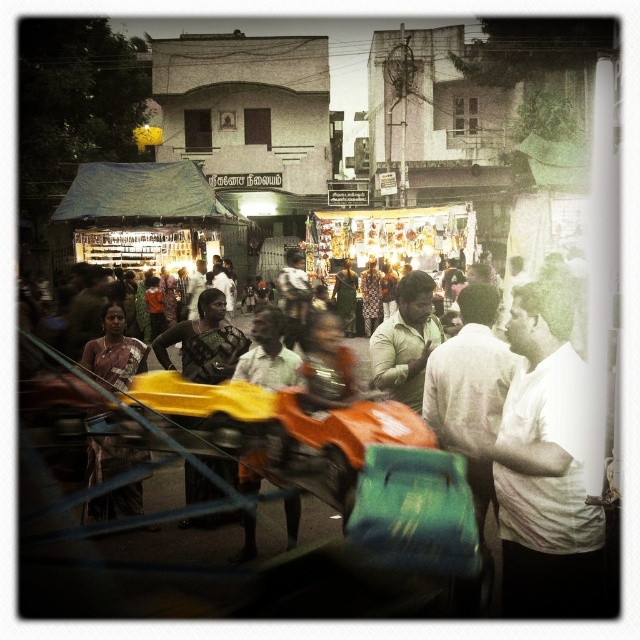
In the scene shown: Between matte black dress at center and matte brown saree at center, which one is positioned lower?

matte brown saree at center is below.

Can you confirm if matte black dress at center is thinner than matte brown saree at center?

Correct, matte black dress at center's width is less than matte brown saree at center's.

This screenshot has height=640, width=640. What are the coordinates of `matte black dress at center` in the screenshot? It's located at (204, 340).

Does matte black dress at center have a greater height compared to light green shirt at center?

Yes, matte black dress at center is taller than light green shirt at center.

Is matte black dress at center positioned at the back of light green shirt at center?

That is True.

I want to click on matte black dress at center, so click(x=204, y=340).

Where is `matte black dress at center`? The height and width of the screenshot is (640, 640). matte black dress at center is located at coordinates (204, 340).

What do you see at coordinates (545, 467) in the screenshot? I see `white cotton shirt at center-right` at bounding box center [545, 467].

Between white cotton shirt at center-right and matte black dress at center, which one is positioned lower?

white cotton shirt at center-right is below.

Who is more distant from viewer, (531, 552) or (189, 358)?

Positioned behind is point (189, 358).

Where is `white cotton shirt at center-right`? white cotton shirt at center-right is located at coordinates (545, 467).